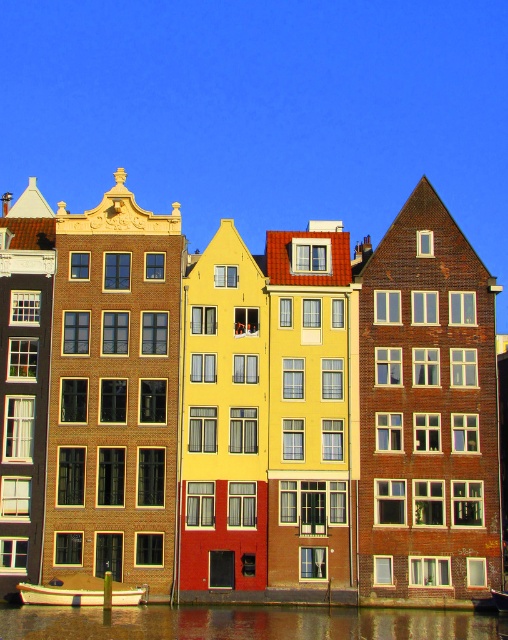
You are standing on the canal side and want to take a photo of the smooth reflective water at lower center. Where exactly should you position your camera to capture the reflection clearly?

You should position your camera directly above or very close to the smooth reflective water at lower center at point (246,624) to capture the reflection clearly.